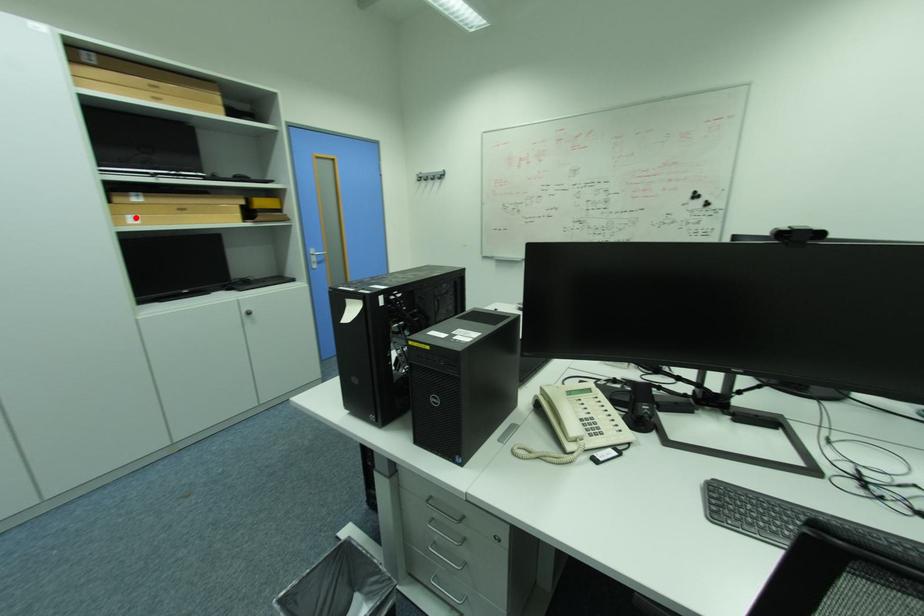
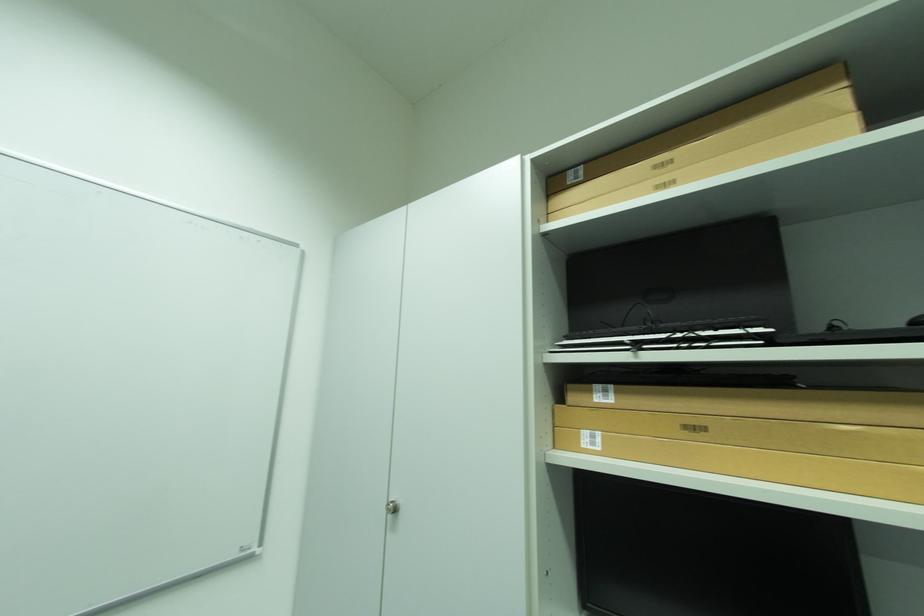
Where in the second image is the point corresponding to the highlighted location from the first image?

(593, 434)